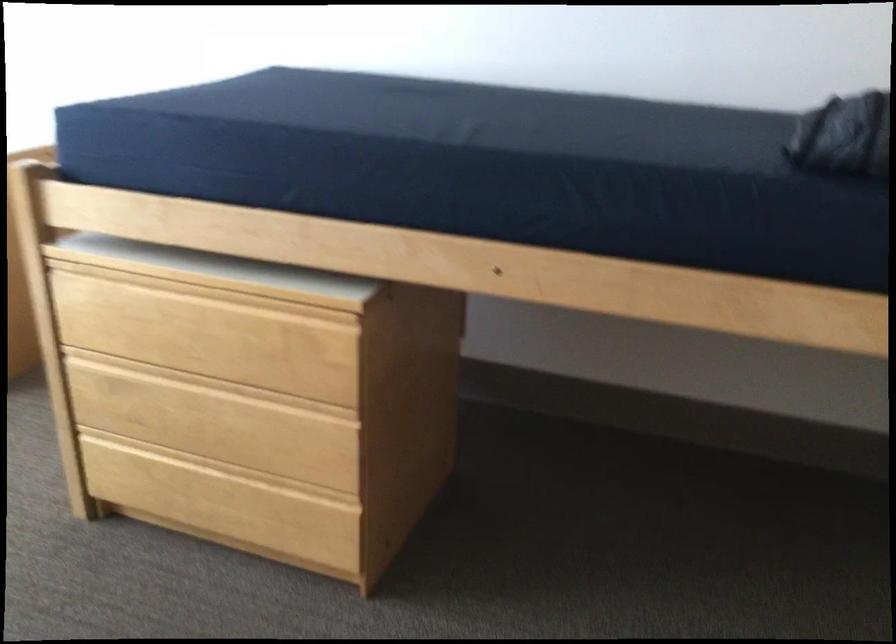
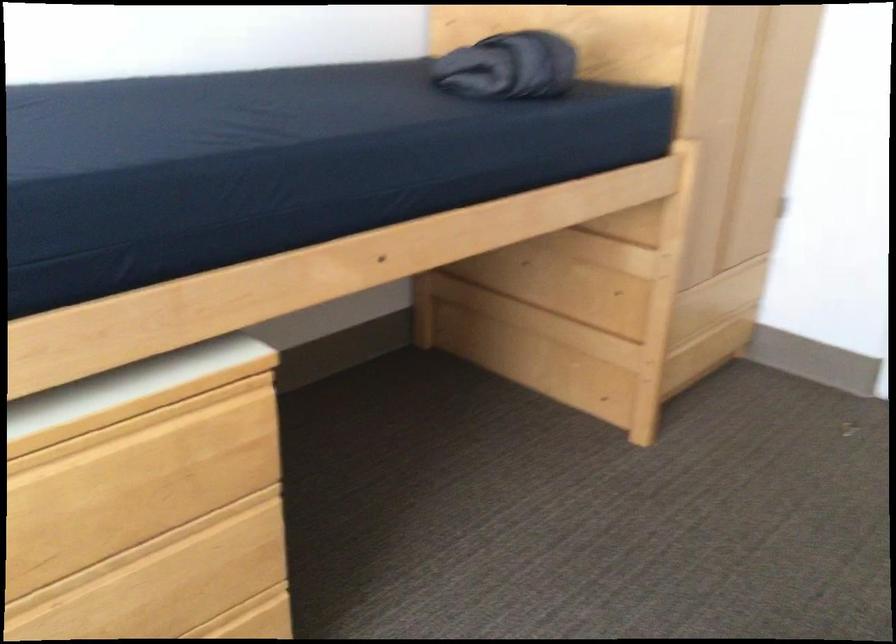
The point at (279, 297) is marked in the first image. Where is the corresponding point in the second image?

(133, 413)